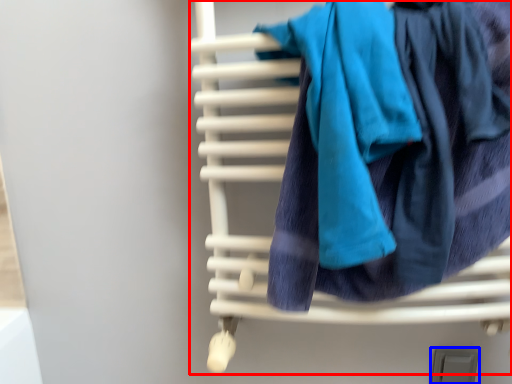
Question: Among these objects, which one is farthest to the camera, furniture (highlighted by a red box) or window (highlighted by a blue box)?

Choices:
 (A) furniture
 (B) window

Answer: (B)